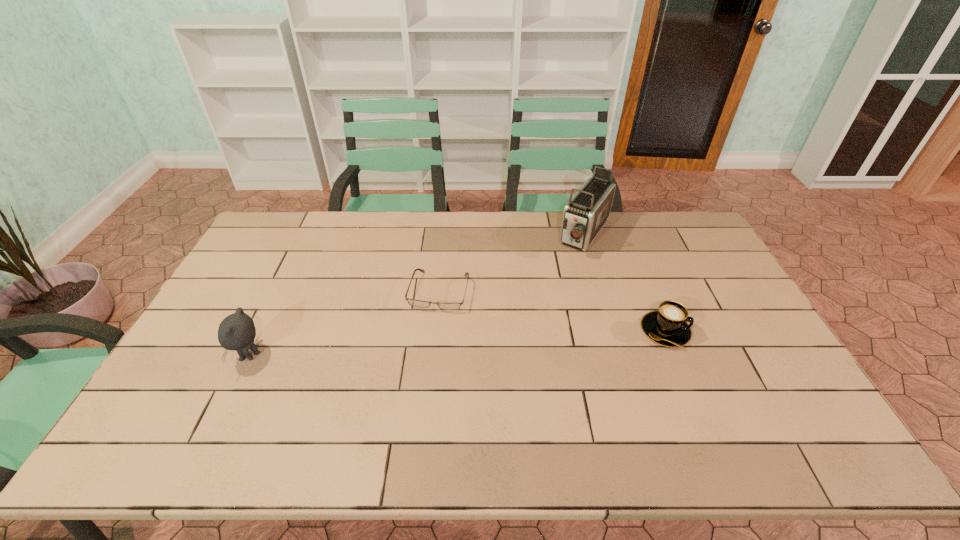
Where is `free space on the desktop that is between the third shortest object and the second shortest object and is positioned on the front-facing side of the spectacles`? This screenshot has height=540, width=960. free space on the desktop that is between the third shortest object and the second shortest object and is positioned on the front-facing side of the spectacles is located at coordinates (424, 345).

The height and width of the screenshot is (540, 960). I want to click on vacant space on the desktop that is between the third shortest object and the cappuccino and is positioned at the lens of the camcorder, so click(508, 340).